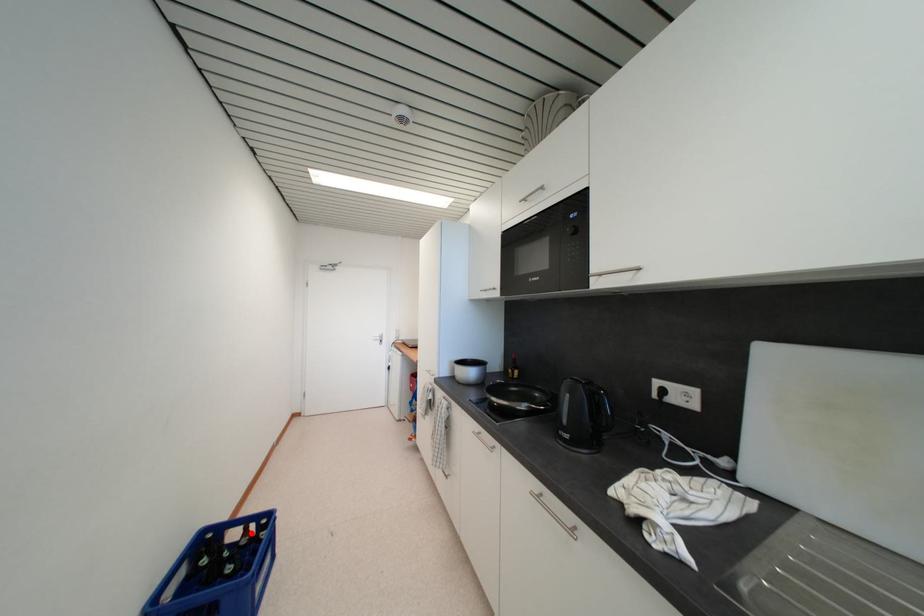
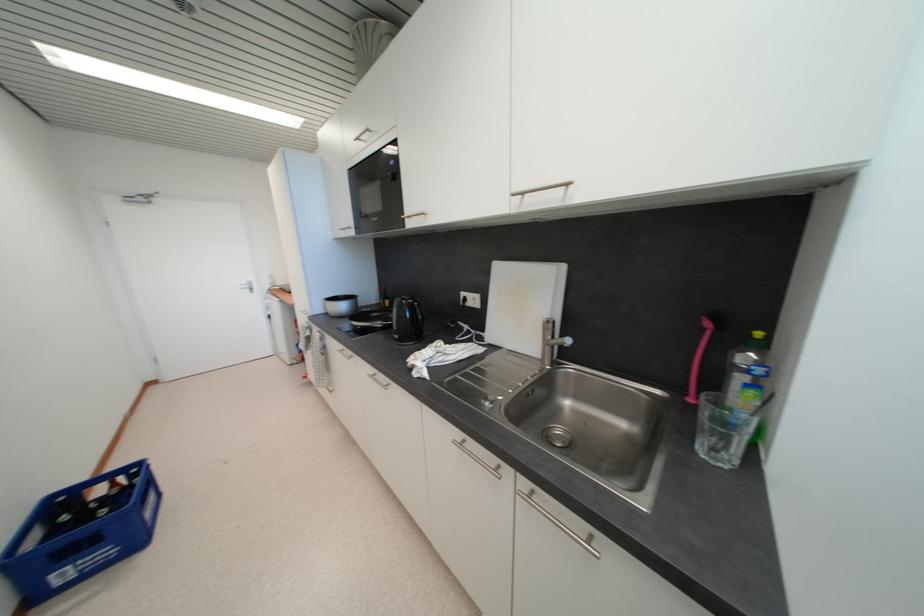
Question: I am providing you with two images of the same scene from different viewpoints. A red point is shown in image1. For the corresponding object point in image2, is it positioned nearer or farther from the camera?

Choices:
 (A) Nearer
 (B) Farther

Answer: (A)